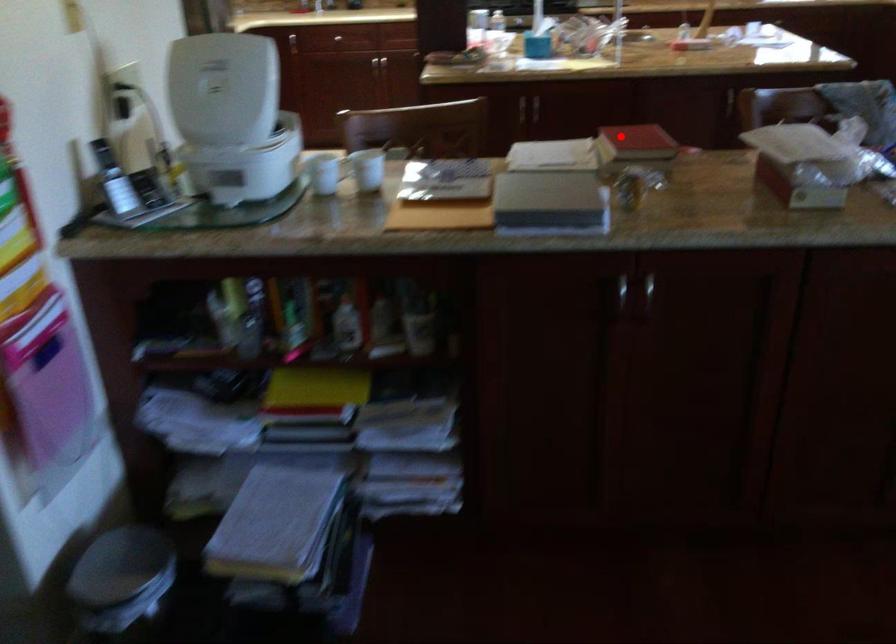
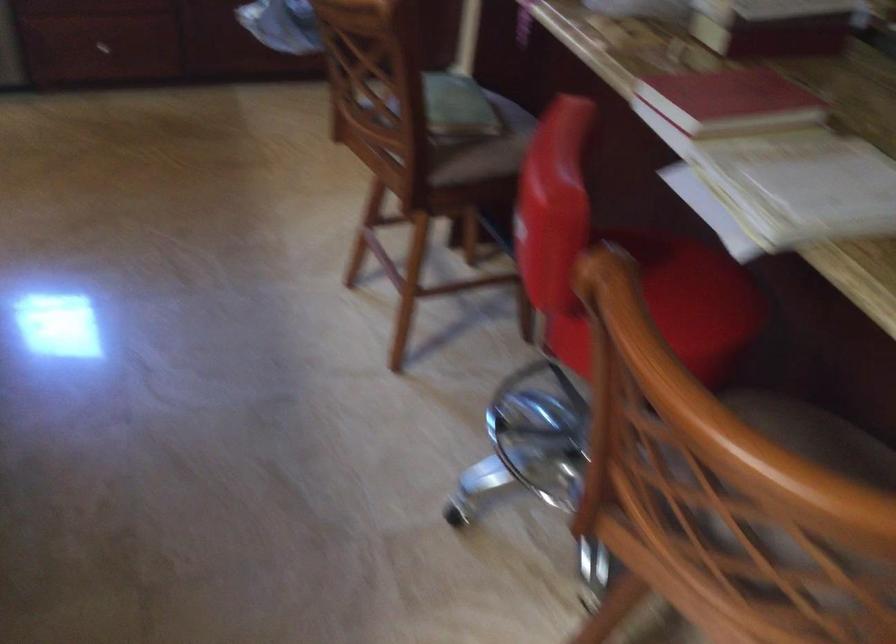
The point at the highlighted location is marked in the first image. Where is the corresponding point in the second image?

(729, 100)